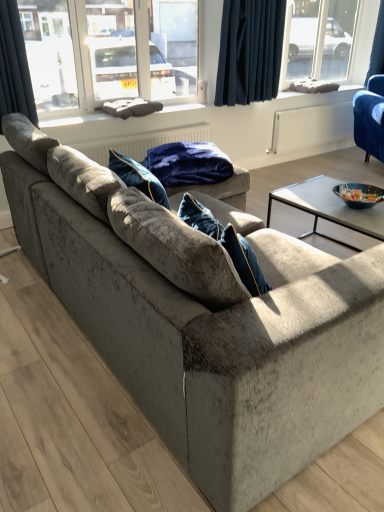
Question: Is blue fabric cushion at upper center, the second window sill ordered from the bottom, to the right of velvet blue blanket at center from the viewer's perspective?

Choices:
 (A) yes
 (B) no

Answer: (A)

Question: From the image's perspective, would you say blue fabric cushion at upper center, the second window sill ordered from the bottom, is shown under velvet blue blanket at center?

Choices:
 (A) no
 (B) yes

Answer: (A)

Question: Can you confirm if blue fabric cushion at upper center, arranged as the 2th window sill when viewed from the left, is wider than velvet blue blanket at center?

Choices:
 (A) no
 (B) yes

Answer: (A)

Question: Is blue fabric cushion at upper center, which is the 1th window sill in back-to-front order, thinner than velvet blue blanket at center?

Choices:
 (A) no
 (B) yes

Answer: (B)

Question: From a real-world perspective, is blue fabric cushion at upper center, which is the 1th window sill in back-to-front order, located higher than velvet blue blanket at center?

Choices:
 (A) no
 (B) yes

Answer: (B)

Question: Considering the positions of velvet blue blanket at center and dark blue fabric at upper center, which is the 2th curtain in left-to-right order, in the image, is velvet blue blanket at center bigger or smaller than dark blue fabric at upper center, which is the 2th curtain in left-to-right order,?

Choices:
 (A) big
 (B) small

Answer: (A)

Question: Is velvet blue blanket at center taller or shorter than dark blue fabric at upper center, which is the second curtain in front-to-back order?

Choices:
 (A) short
 (B) tall

Answer: (A)

Question: Considering the positions of velvet blue blanket at center and dark blue fabric at upper center, which is the 2th curtain in left-to-right order, in the image, is velvet blue blanket at center wider or thinner than dark blue fabric at upper center, which is the 2th curtain in left-to-right order,?

Choices:
 (A) wide
 (B) thin

Answer: (A)

Question: Is point (190, 159) positioned closer to the camera than point (276, 75)?

Choices:
 (A) closer
 (B) farther

Answer: (A)

Question: Based on their sizes in the image, would you say dark blue velvet curtain at upper left, the 1th curtain in the front-to-back sequence, is bigger or smaller than blue fabric cushion at upper center, arranged as the 2th window sill when viewed from the left?

Choices:
 (A) big
 (B) small

Answer: (A)

Question: From a real-world perspective, is dark blue velvet curtain at upper left, the 1th curtain in the front-to-back sequence, physically located above or below blue fabric cushion at upper center, arranged as the 2th window sill when viewed from the left?

Choices:
 (A) below
 (B) above

Answer: (B)

Question: From the image's perspective, is dark blue velvet curtain at upper left, arranged as the 1th curtain when viewed from the left, above or below blue fabric cushion at upper center, which is the second window sill in front-to-back order?

Choices:
 (A) above
 (B) below

Answer: (B)

Question: In the image, is dark blue velvet curtain at upper left, the third curtain positioned from the right, positioned in front of or behind blue fabric cushion at upper center, which is the second window sill in front-to-back order?

Choices:
 (A) front
 (B) behind

Answer: (A)

Question: Is blue fabric cushion at upper center, the second window sill ordered from the bottom, wider or thinner than velvet blue armchair at upper right?

Choices:
 (A) thin
 (B) wide

Answer: (A)

Question: Is blue fabric cushion at upper center, which is the first window sill from top to bottom, spatially inside velvet blue armchair at upper right, or outside of it?

Choices:
 (A) outside
 (B) inside

Answer: (A)